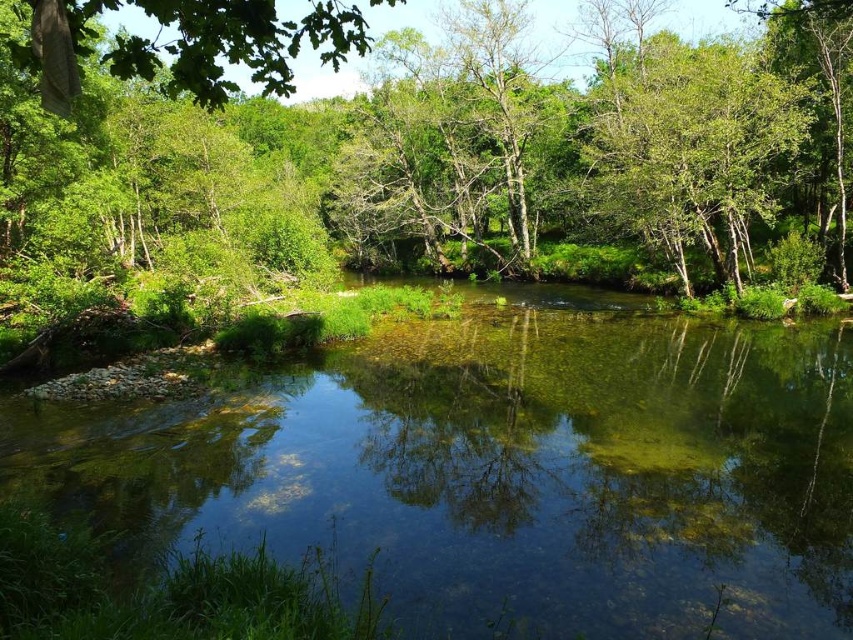
Does point (3, 92) come closer to viewer compared to point (64, 77)?

No, it is not.

Who is more forward, (260, 74) or (206, 45)?

Point (206, 45) is in front.

This screenshot has width=853, height=640. I want to click on green leafy tree at center, so click(x=450, y=148).

Does clear glass river at center have a greater height compared to green leafy tree at upper right?

No.

Does point (683, 404) lie behind point (706, 177)?

No.

In order to click on clear glass river at center in this screenshot , I will do `click(502, 470)`.

Can you confirm if green leafy tree at upper right is positioned above green leafy tree at upper left?

No.

Does green leafy tree at upper right have a greater height compared to green leafy tree at upper left?

Incorrect, green leafy tree at upper right's height is not larger of green leafy tree at upper left's.

Is point (699, 80) closer to camera compared to point (73, 44)?

No, it is not.

Where is `green leafy tree at upper right`? This screenshot has width=853, height=640. green leafy tree at upper right is located at coordinates (689, 147).